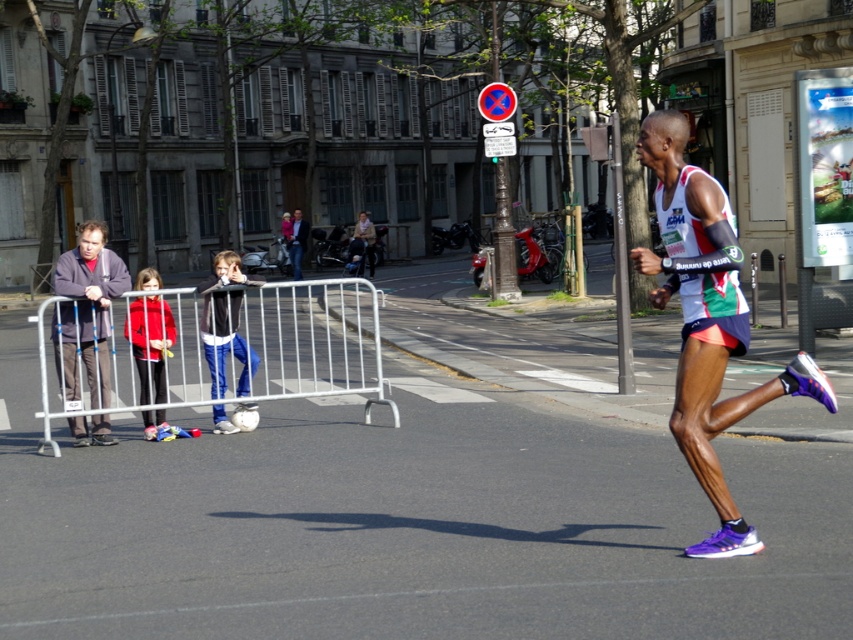
You are a photographer positioned at the marathon event. You need to capture a photo that includes both the gray fabric jacket at left and the blue jeans at center. Based on their positions, which object should you focus on first to ensure both are in frame?

The gray fabric jacket at left is located above the blue jeans at center, so you should focus on the gray fabric jacket at left first to ensure both are in frame.

You are a photographer positioned at the back of the barricade. You want to capture a photo of the blue jeans at center and the matte black jacket at center in the same frame. Which object should you adjust your camera angle to focus on first to ensure both fit in the frame?

The blue jeans at center is wider than the matte black jacket at center, so you should focus on the blue jeans at center first to ensure both fit in the frame.